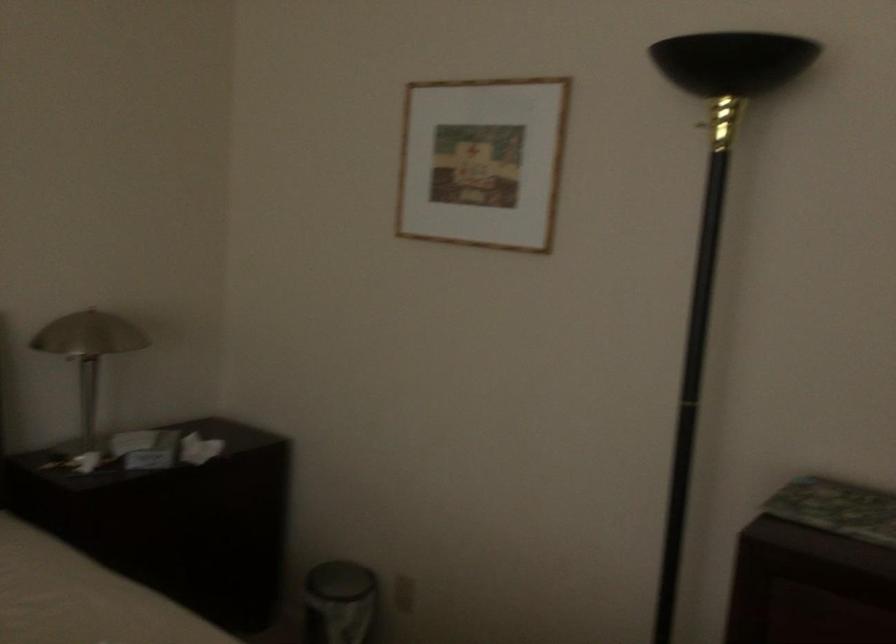
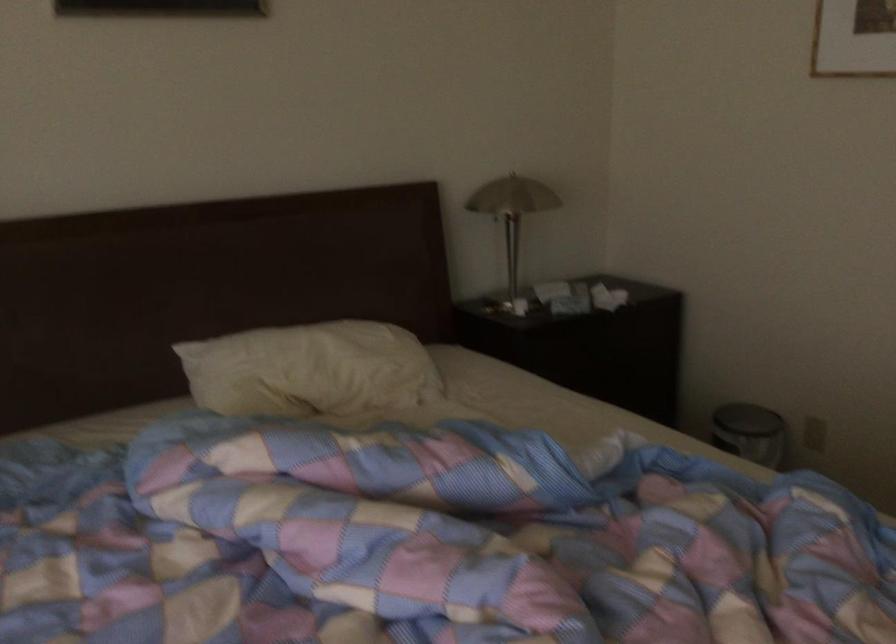
Question: The images are taken continuously from a first-person perspective. In which direction is your viewpoint rotating?

Choices:
 (A) Left
 (B) Right
 (C) Up
 (D) Down

Answer: (A)